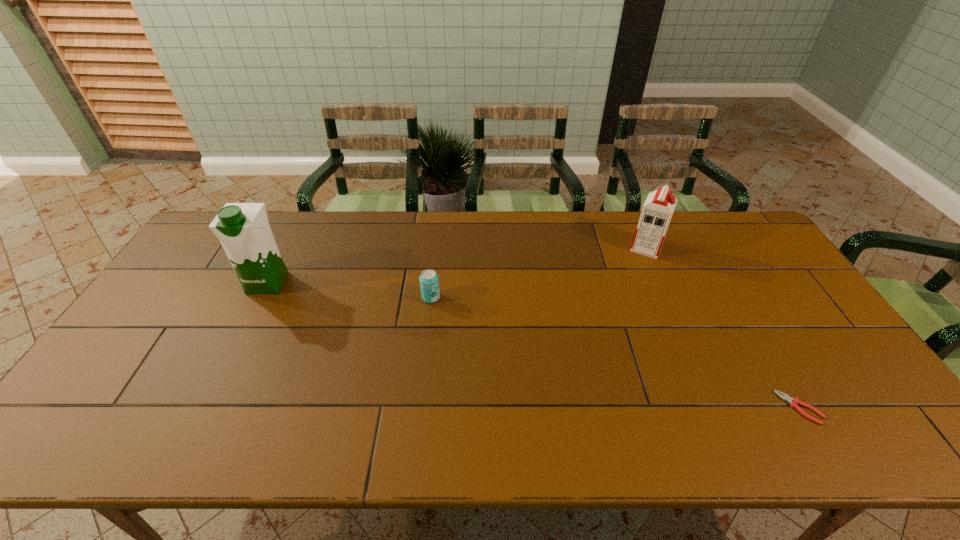
Where is `empty location between the third object from right to left and the rightmost object`? empty location between the third object from right to left and the rightmost object is located at coordinates (615, 353).

Find the location of a particular element. vacant area that lies between the taller soya milk and the second shortest object is located at coordinates (349, 290).

Locate an element on the screen. The image size is (960, 540). unoccupied position between the rightmost object and the farther soya milk is located at coordinates (723, 328).

Find the location of a particular element. unoccupied position between the nearest object and the taller soya milk is located at coordinates click(x=534, y=345).

Locate an element on the screen. unoccupied area between the nearer soya milk and the shortest object is located at coordinates tap(534, 345).

Locate an element on the screen. The width and height of the screenshot is (960, 540). empty location between the rightmost object and the third tallest object is located at coordinates pos(615,353).

Find the location of a particular element. The height and width of the screenshot is (540, 960). free space between the rightmost object and the second object from left to right is located at coordinates (615, 353).

Locate an element on the screen. empty space that is in between the farthest object and the rightmost object is located at coordinates (723, 328).

I want to click on free space between the right soya milk and the pliers, so 723,328.

Find the location of a particular element. This screenshot has height=540, width=960. blank region between the second shortest object and the right soya milk is located at coordinates (539, 273).